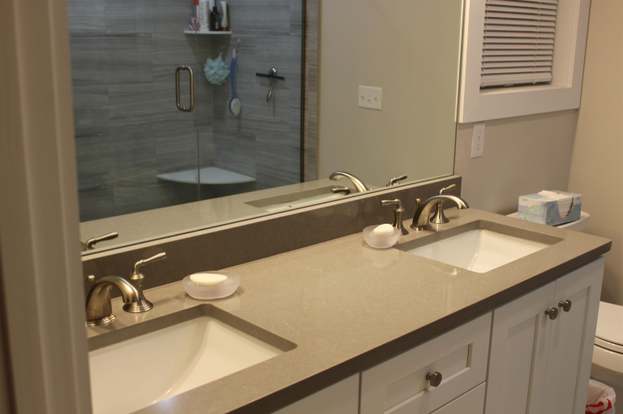
At what (x,y) coordinates should I click in order to perform the action: click on tissues. Please return your answer as a coordinate pair (x, y). Looking at the image, I should click on 564,203.